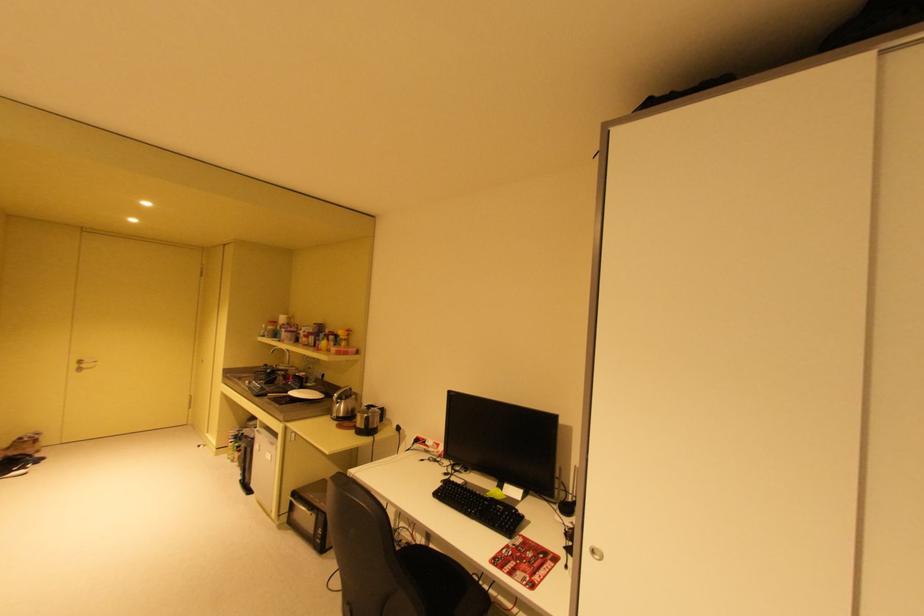
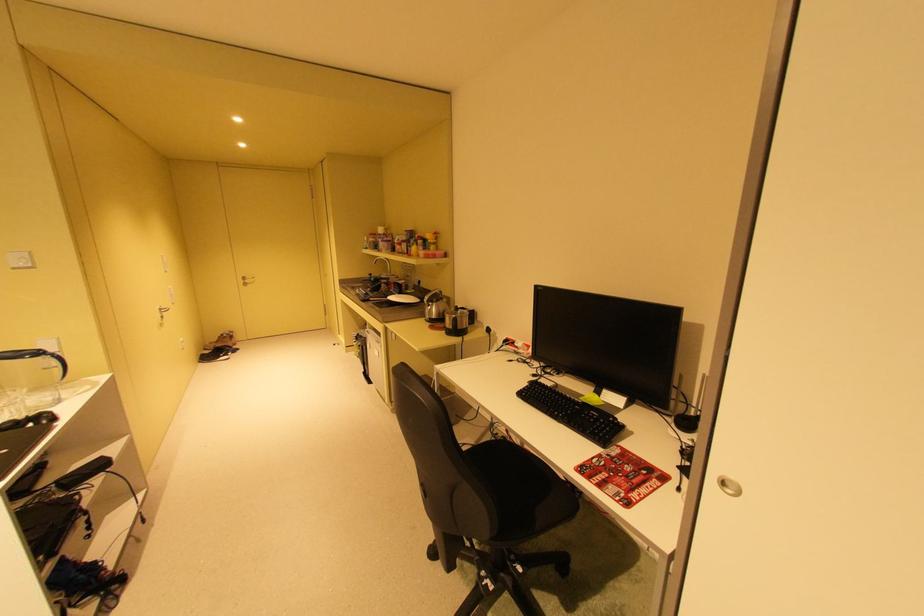
Where in the second image is the point corresponding to point 347,399 from the first image?

(439, 302)